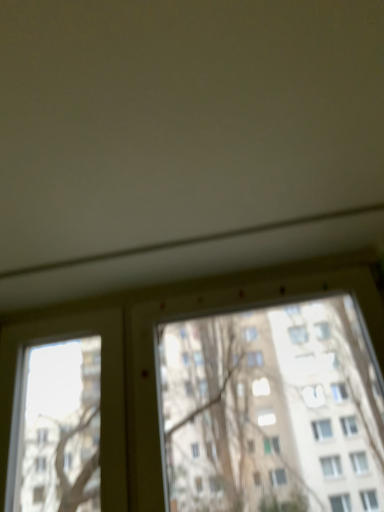
The image size is (384, 512). Find the location of `transparent glass window at center`. transparent glass window at center is located at coordinates pos(200,401).

What is the approximate width of transparent glass window at center?

The width of transparent glass window at center is 3.57 inches.

This screenshot has height=512, width=384. What do you see at coordinates (200, 401) in the screenshot?
I see `transparent glass window at center` at bounding box center [200, 401].

Where is `transparent glass window at center`? The height and width of the screenshot is (512, 384). transparent glass window at center is located at coordinates (200, 401).